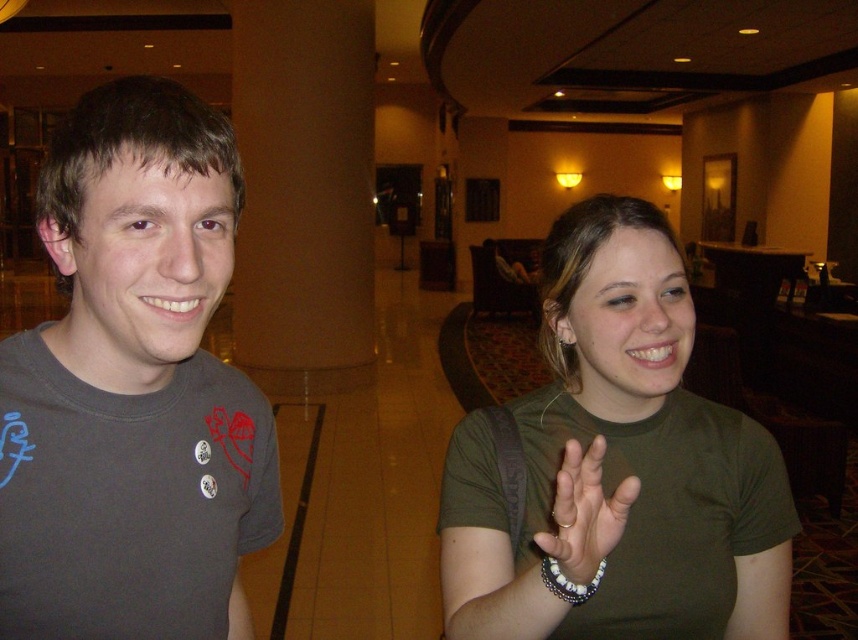
Question: Which of the following is the closest to the observer?

Choices:
 (A) white beaded bracelet at lower right
 (B) green matte shirt at center
 (C) dark gray t-shirt at left

Answer: (A)

Question: Is dark gray t-shirt at left positioned in front of white beaded bracelet at lower right?

Choices:
 (A) no
 (B) yes

Answer: (A)

Question: Which object is positioned farthest from the green matte shirt at center?

Choices:
 (A) white beaded bracelet at lower right
 (B) dark gray t-shirt at left

Answer: (B)

Question: Considering the real-world distances, which object is farthest from the dark gray t-shirt at left?

Choices:
 (A) white beaded bracelet at lower right
 (B) green matte shirt at center

Answer: (A)

Question: From the image, what is the correct spatial relationship of green matte shirt at center in relation to white beaded bracelet at lower right?

Choices:
 (A) left
 (B) right

Answer: (B)

Question: Does dark gray t-shirt at left appear on the right side of white beaded bracelet at lower right?

Choices:
 (A) no
 (B) yes

Answer: (A)